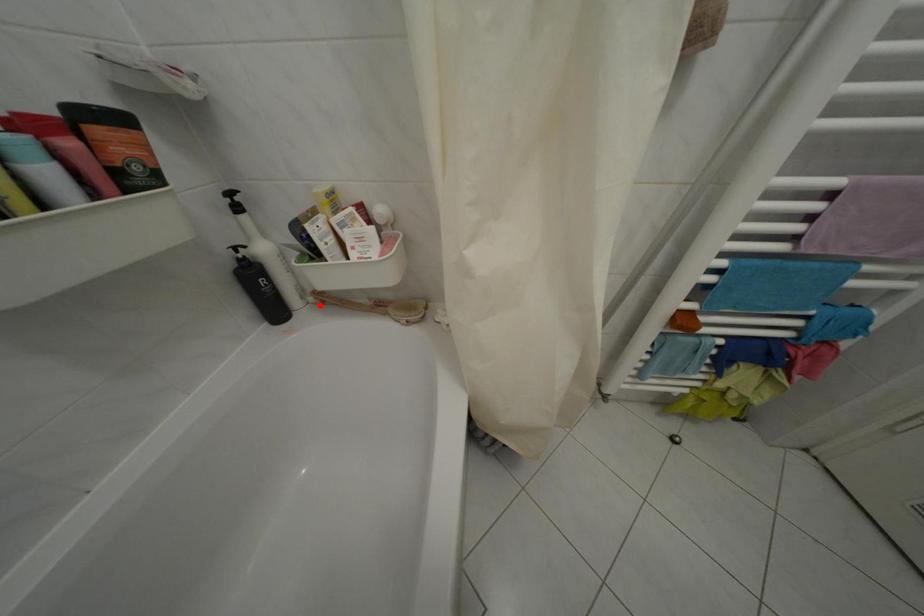
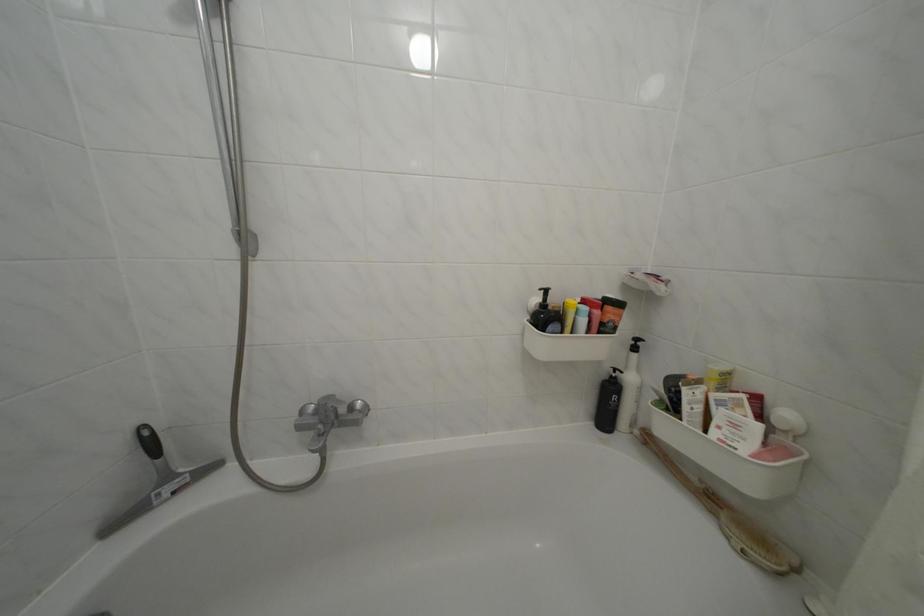
Question: I am providing you with two images of the same scene from different viewpoints. In image1, a red point is highlighted. Considering the same 3D point in image2, which of the following is correct?

Choices:
 (A) It is closer
 (B) It is farther

Answer: (B)